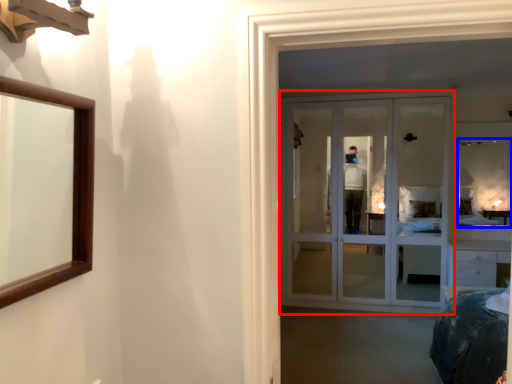
Question: Among these objects, which one is farthest to the camera, door (highlighted by a red box) or mirror (highlighted by a blue box)?

Choices:
 (A) door
 (B) mirror

Answer: (B)